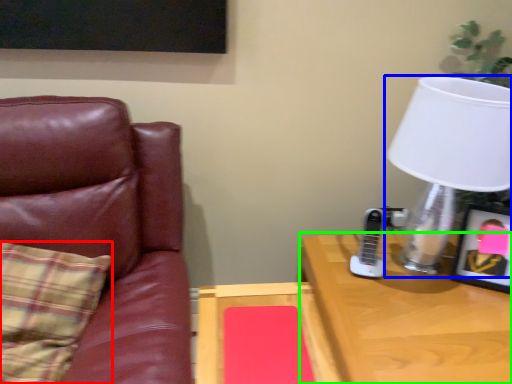
Question: Which is farther away from pillow (highlighted by a red box)? lamp (highlighted by a blue box) or desk (highlighted by a green box)?

Choices:
 (A) lamp
 (B) desk

Answer: (A)